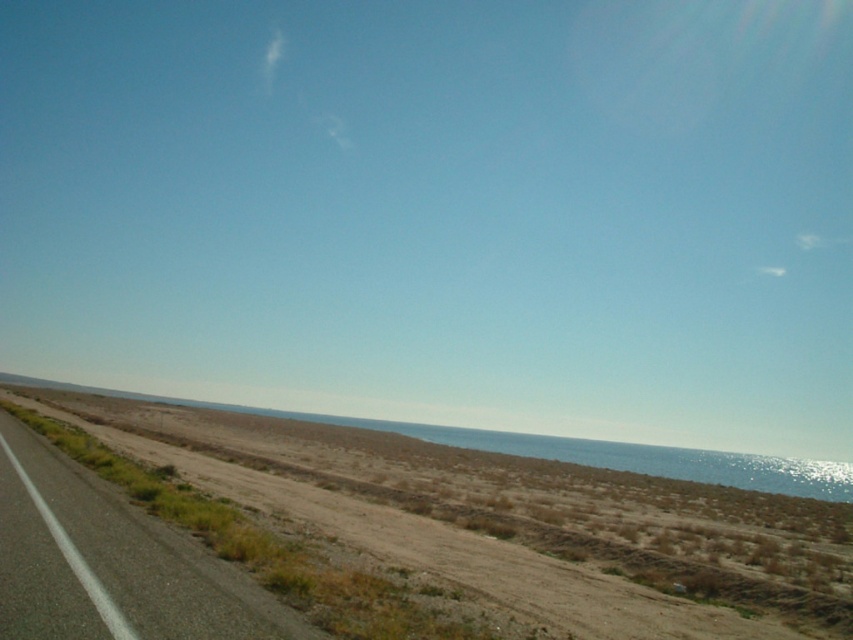
Question: Does asphalt road at left have a lesser width compared to brown/dry soil at center?

Choices:
 (A) yes
 (B) no

Answer: (A)

Question: Which point is closer to the camera taking this photo?

Choices:
 (A) (64, 474)
 (B) (820, 506)
 (C) (299, 416)

Answer: (A)

Question: Is brown sandy desert at lower left to the left of brown/dry soil at center from the viewer's perspective?

Choices:
 (A) no
 (B) yes

Answer: (A)

Question: Is brown sandy desert at lower left wider than brown/dry soil at center?

Choices:
 (A) yes
 (B) no

Answer: (B)

Question: Based on their relative distances, which object is farther from the asphalt road at left?

Choices:
 (A) brown sandy desert at lower left
 (B) brown/dry soil at center

Answer: (B)

Question: Which point is closer to the camera taking this photo?

Choices:
 (A) (148, 592)
 (B) (585, 440)

Answer: (A)